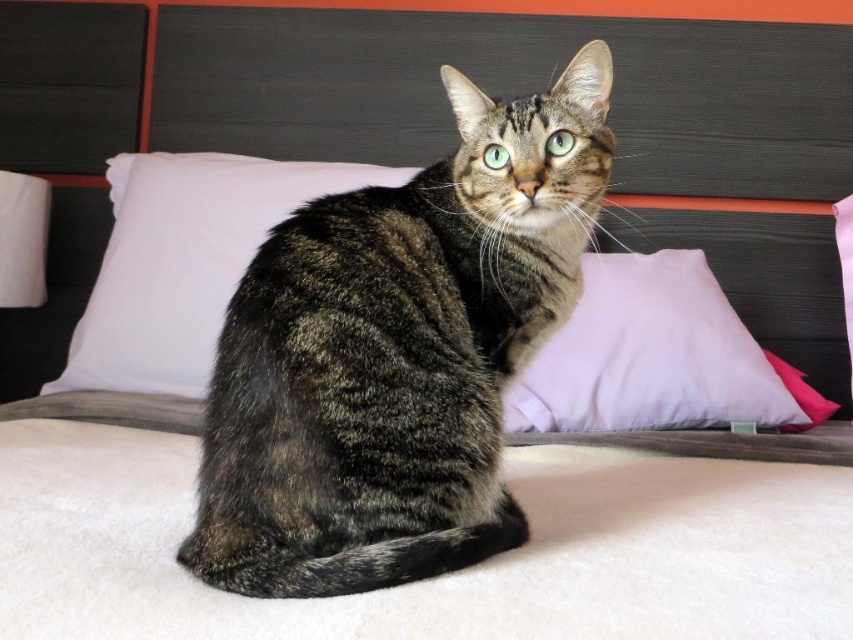
You are arranging a cat bed and want to place the white soft pillow at center and pink fabric pillow at center. According to the image, which pillow should be placed on the left side?

The white soft pillow at center should be placed on the left side because it is to the left of the pink fabric pillow at center in the image.

What are the coordinates of the shiny brown fur cat at center?

The coordinates of the shiny brown fur cat at center are at point (x=397, y=353).

You are a cat owner who wants to place a new toy exactly at the center of the bed. The bed has a white soft pillow at center. Where should you place the toy?

The center of the bed is at the position of the white soft pillow at center, which is located at point [184,260]. Therefore, you should place the toy there.